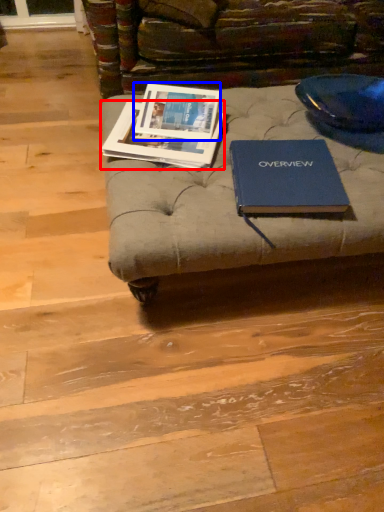
Question: Which object appears farthest to the camera in this image, book (highlighted by a red box) or book cover (highlighted by a blue box)?

Choices:
 (A) book
 (B) book cover

Answer: (B)